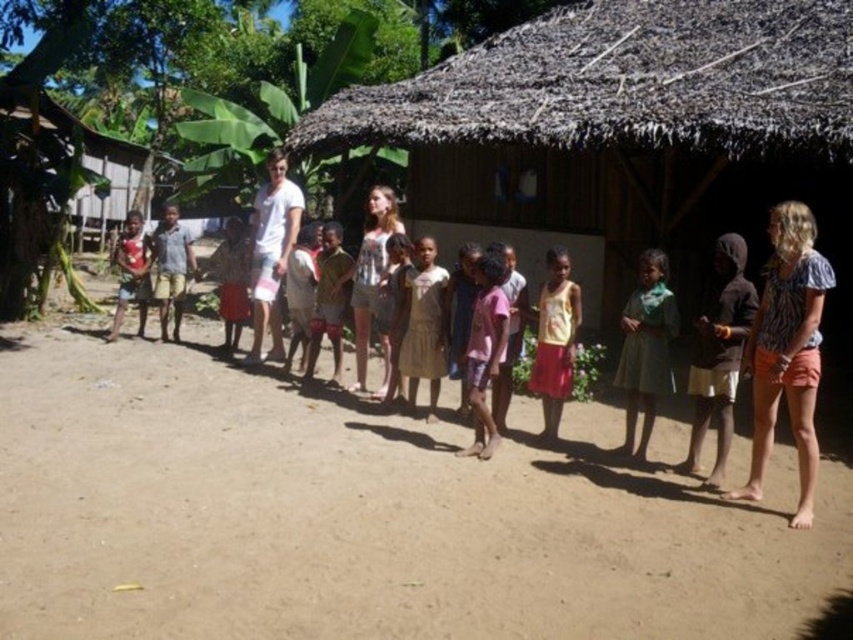
You are standing in front of the brown thatched roof at center. If you want to take a photo of it with your smartphone, which has a maximum focus range of 10 meters, will the roof be in focus?

The brown thatched roof at center is 10.18 meters away from camera, which exceeds the smartphone camera maximum focus range of 10 meters. Therefore, the roof will not be in focus.

In the scene shown: You are standing in front of the traditional thatched roof structure and notice two items at the center of the scene. Which item is located to the left of the other? The brown sandy ground at center and the yellow cotton tank top at center.

The yellow cotton tank top at center is to the left of the brown sandy ground at center because the brown sandy ground at center is positioned on the right side of the yellow cotton tank top at center.

You are a photographer trying to capture a photo of the brown thatched roof at center and the green fabric dress at center. Since you want both subjects to be in focus, you need to adjust your camera settings. Which subject should you focus on first to ensure proper depth of field?

The brown thatched roof at center is shorter than the green fabric dress at center, so you should focus on the brown thatched roof at center first to ensure both are in focus.